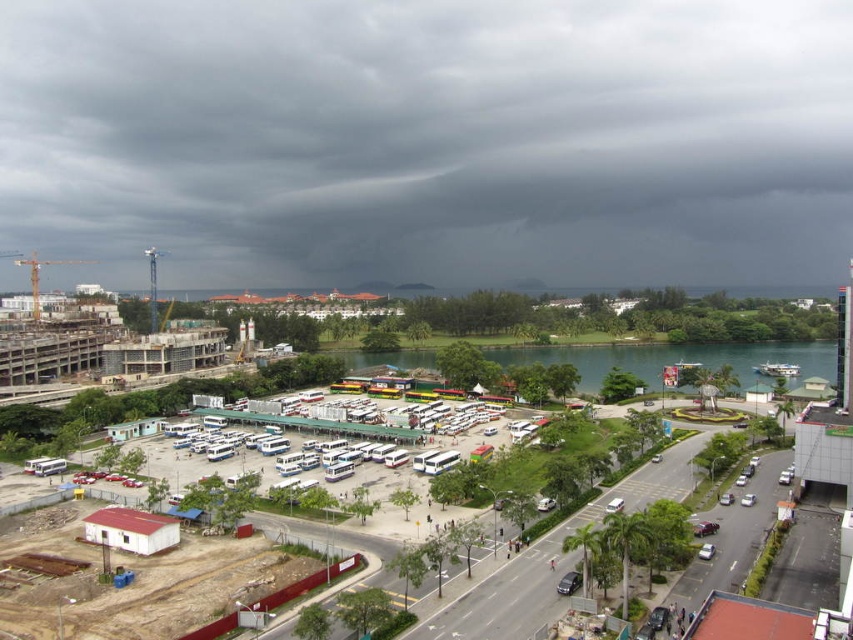
Question: Among these points, which one is farthest from the camera?

Choices:
 (A) (589, 376)
 (B) (198, 157)

Answer: (B)

Question: Is the position of dark gray cloud at upper center more distant than that of concrete construction site at center?

Choices:
 (A) yes
 (B) no

Answer: (A)

Question: Where is dark gray cloud at upper center located in relation to concrete construction site at center in the image?

Choices:
 (A) above
 (B) below

Answer: (A)

Question: Can you confirm if dark gray cloud at upper center is positioned to the left of concrete construction site at center?

Choices:
 (A) yes
 (B) no

Answer: (A)